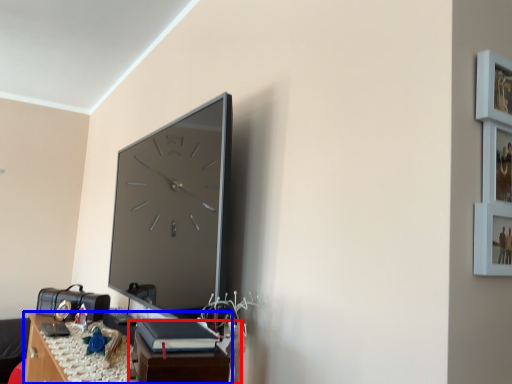
Question: Which point is further to the camera, table (highlighted by a red box) or table (highlighted by a blue box)?

Choices:
 (A) table
 (B) table

Answer: (B)